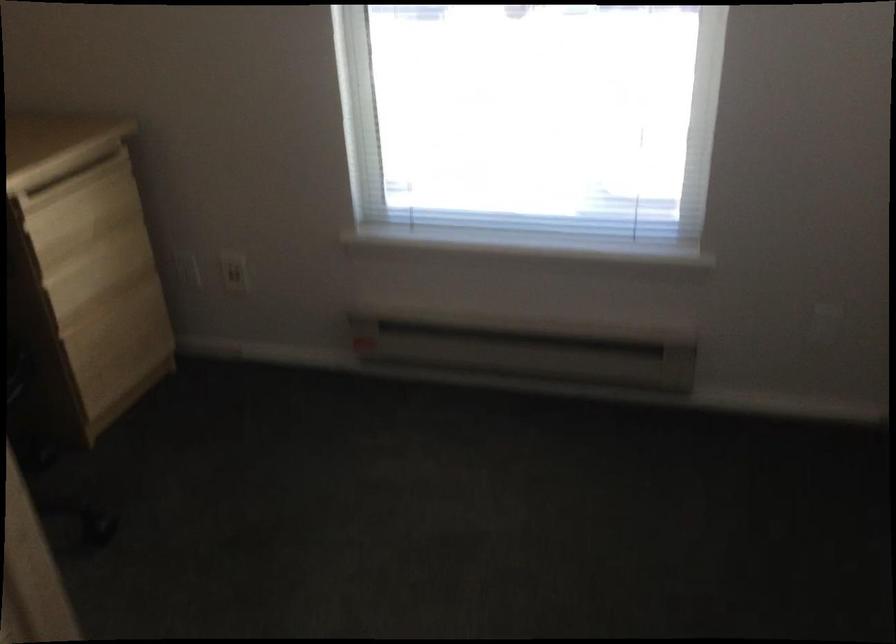
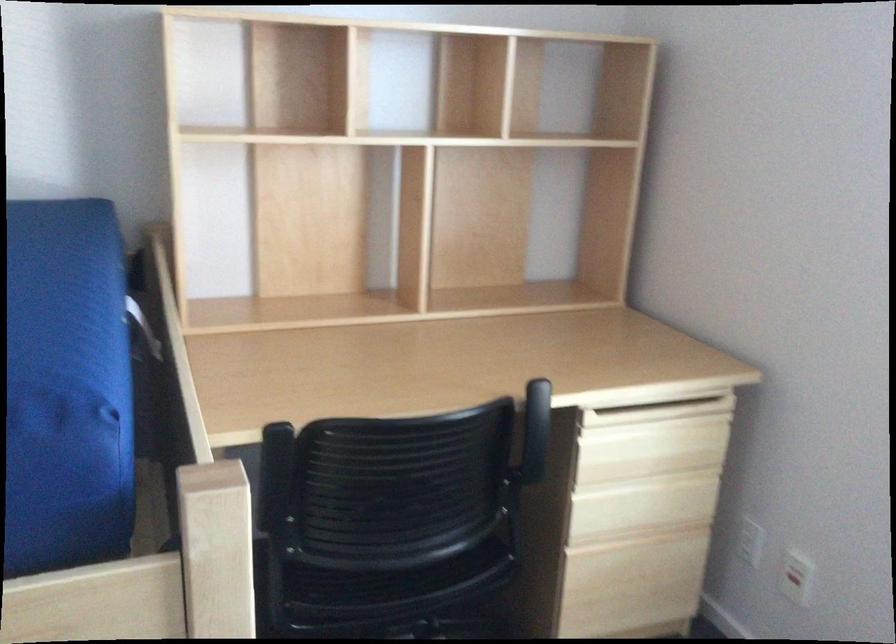
Question: The images are taken continuously from a first-person perspective. In which direction is your viewpoint rotating?

Choices:
 (A) Left
 (B) Right
 (C) Up
 (D) Down

Answer: (A)